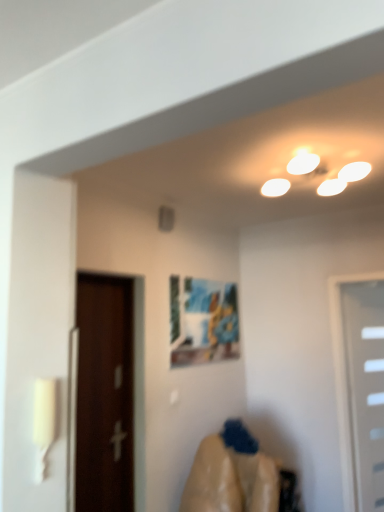
Question: In terms of height, does smooth beige fabric at lower center look taller or shorter compared to matte plastic picture frame at center?

Choices:
 (A) short
 (B) tall

Answer: (B)

Question: In the image, is smooth beige fabric at lower center positioned in front of or behind matte plastic picture frame at center?

Choices:
 (A) front
 (B) behind

Answer: (A)

Question: Estimate the real-world distances between objects in this image. Which object is farther from the smooth beige fabric at lower center?

Choices:
 (A) brown wooden door at left, the second door from the back
 (B) matte plastic picture frame at center
 (C) white plastic door at right, which appears as the 1th door when viewed from the right

Answer: (C)

Question: Which of these objects is positioned closest to the smooth beige fabric at lower center?

Choices:
 (A) brown wooden door at left, the 2th door in the right-to-left sequence
 (B) white plastic door at right, the 1th door in the back-to-front sequence
 (C) matte plastic picture frame at center

Answer: (A)